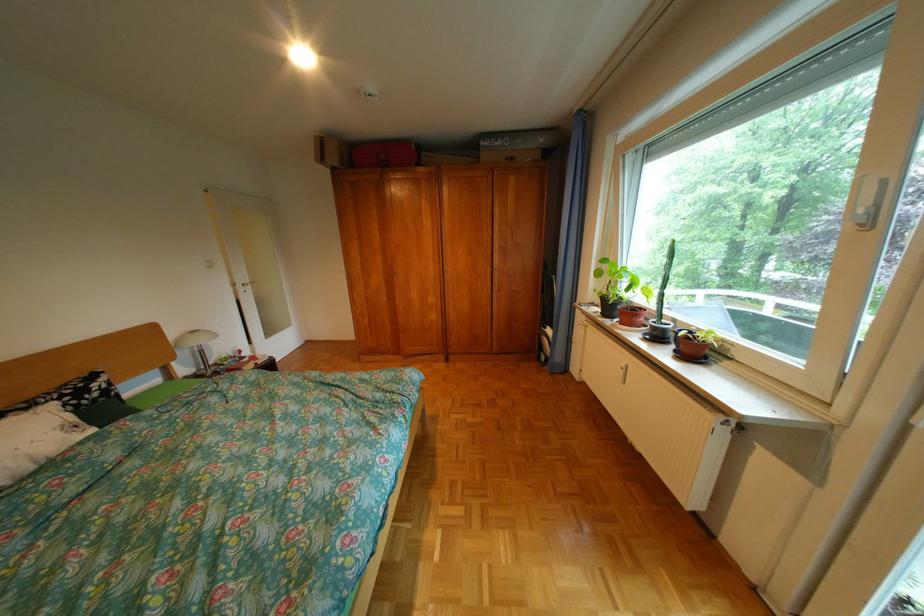
The height and width of the screenshot is (616, 924). What do you see at coordinates (738, 437) in the screenshot?
I see `the radiator control knob` at bounding box center [738, 437].